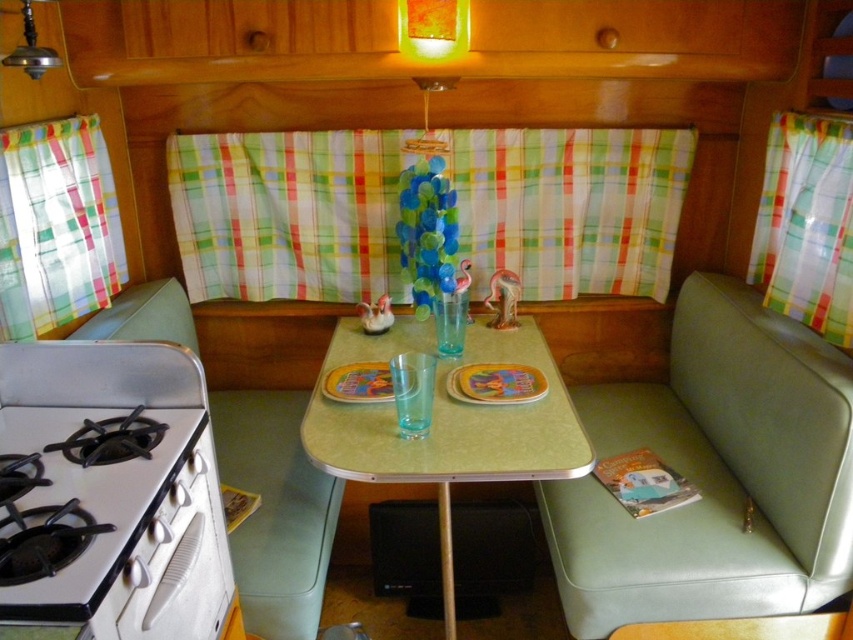
Question: Among these objects, which one is farthest from the camera?

Choices:
 (A) yellow matte plate at center
 (B) white glossy gas stove at lower left
 (C) green vinyl couch at lower right
 (D) green formica table at center

Answer: (A)

Question: Is green vinyl couch at lower right in front of green formica table at center?

Choices:
 (A) yes
 (B) no

Answer: (B)

Question: Does green vinyl couch at lower right appear under green formica table at center?

Choices:
 (A) no
 (B) yes

Answer: (A)

Question: Among these points, which one is farthest from the camera?

Choices:
 (A) (360, 476)
 (B) (91, 493)
 (C) (567, 554)

Answer: (C)

Question: Does green vinyl couch at lower right have a greater width compared to green formica table at center?

Choices:
 (A) yes
 (B) no

Answer: (A)

Question: Which point is farther from the camera taking this photo?

Choices:
 (A) (180, 593)
 (B) (448, 518)
 (C) (798, 344)
 (D) (473, 392)

Answer: (B)